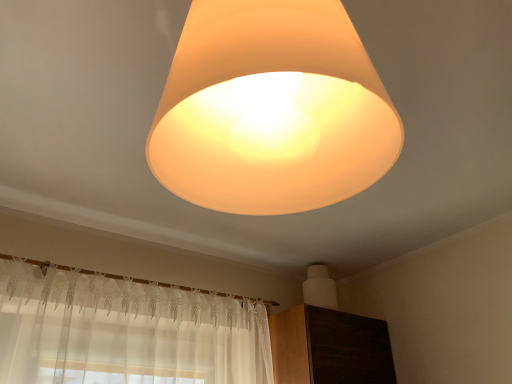
Question: Can you confirm if dark wood dresser at lower right is bigger than matte orange lampshade at upper center?

Choices:
 (A) no
 (B) yes

Answer: (B)

Question: Does dark wood dresser at lower right touch matte orange lampshade at upper center?

Choices:
 (A) yes
 (B) no

Answer: (B)

Question: Is dark wood dresser at lower right facing towards matte orange lampshade at upper center?

Choices:
 (A) no
 (B) yes

Answer: (A)

Question: Can you confirm if dark wood dresser at lower right is shorter than matte orange lampshade at upper center?

Choices:
 (A) no
 (B) yes

Answer: (B)

Question: From a real-world perspective, is dark wood dresser at lower right under matte orange lampshade at upper center?

Choices:
 (A) yes
 (B) no

Answer: (A)

Question: Considering the relative positions of dark wood dresser at lower right and matte orange lampshade at upper center in the image provided, is dark wood dresser at lower right in front of matte orange lampshade at upper center?

Choices:
 (A) yes
 (B) no

Answer: (B)

Question: Is the position of matte orange lampshade at upper center less distant than that of dark wood dresser at lower right?

Choices:
 (A) no
 (B) yes

Answer: (B)

Question: Is matte orange lampshade at upper center aimed at dark wood dresser at lower right?

Choices:
 (A) yes
 (B) no

Answer: (B)

Question: Is matte orange lampshade at upper center at the right side of dark wood dresser at lower right?

Choices:
 (A) yes
 (B) no

Answer: (B)

Question: From a real-world perspective, is matte orange lampshade at upper center over dark wood dresser at lower right?

Choices:
 (A) yes
 (B) no

Answer: (A)

Question: From a real-world perspective, is matte orange lampshade at upper center physically below dark wood dresser at lower right?

Choices:
 (A) yes
 (B) no

Answer: (B)

Question: Is matte orange lampshade at upper center oriented away from dark wood dresser at lower right?

Choices:
 (A) yes
 (B) no

Answer: (B)

Question: Looking at the image, does matte orange lampshade at upper center seem bigger or smaller compared to dark wood dresser at lower right?

Choices:
 (A) big
 (B) small

Answer: (B)